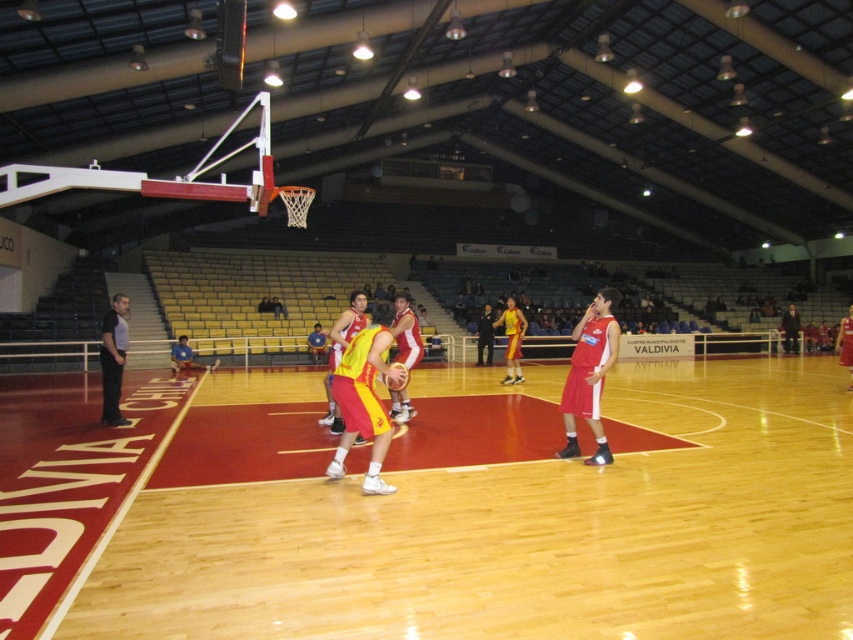
Describe the element at coordinates (113, 358) in the screenshot. I see `black smooth shirt at left` at that location.

Is black smooth shirt at left to the right of red jersey at center from the viewer's perspective?

No, black smooth shirt at left is not to the right of red jersey at center.

Measure the distance between point (126, 332) and camera.

The distance of point (126, 332) from camera is 12.03 meters.

Locate an element on the screen. Image resolution: width=853 pixels, height=640 pixels. black smooth shirt at left is located at coordinates (113, 358).

Can you confirm if black smooth shirt at left is thinner than yellow matte basketball at center?

No, black smooth shirt at left is not thinner than yellow matte basketball at center.

Who is more forward, (103, 397) or (392, 380)?

Point (392, 380) is more forward.

This screenshot has width=853, height=640. What do you see at coordinates (113, 358) in the screenshot?
I see `black smooth shirt at left` at bounding box center [113, 358].

In order to click on black smooth shirt at left in this screenshot , I will do `click(113, 358)`.

Does point (607, 316) lie in front of point (390, 376)?

No.

Identify the location of matte red shorts at center. The image size is (853, 640). (590, 374).